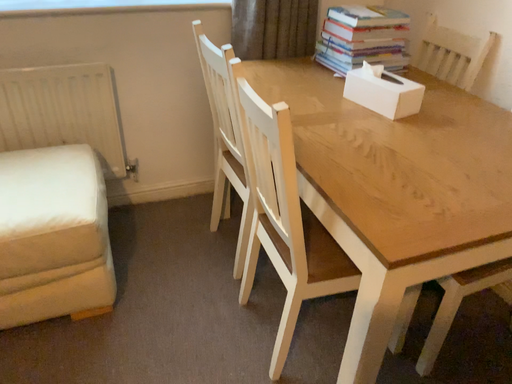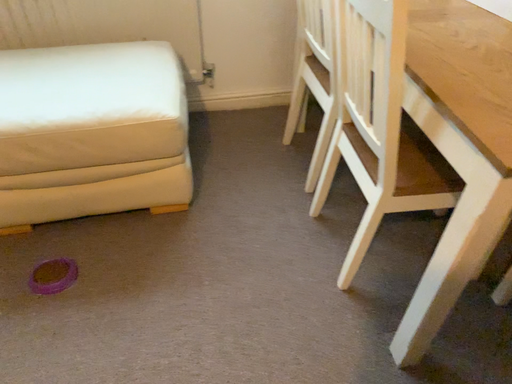
Question: How did the camera likely rotate when shooting the video?

Choices:
 (A) rotated right
 (B) rotated left

Answer: (B)